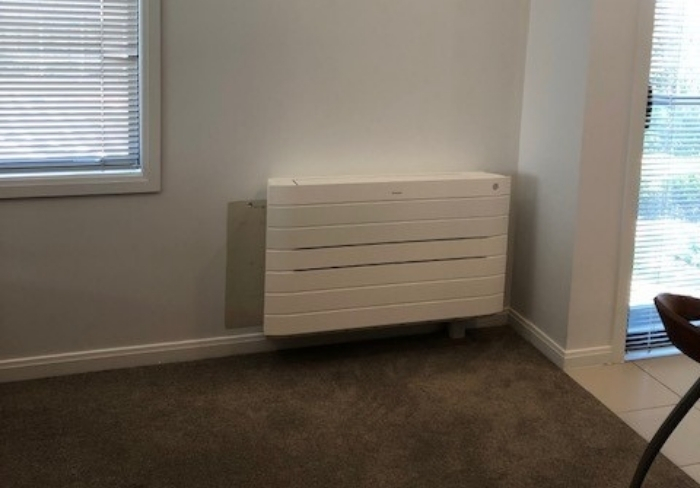
Where is `window with white blinds`? The width and height of the screenshot is (700, 488). window with white blinds is located at coordinates (32, 72).